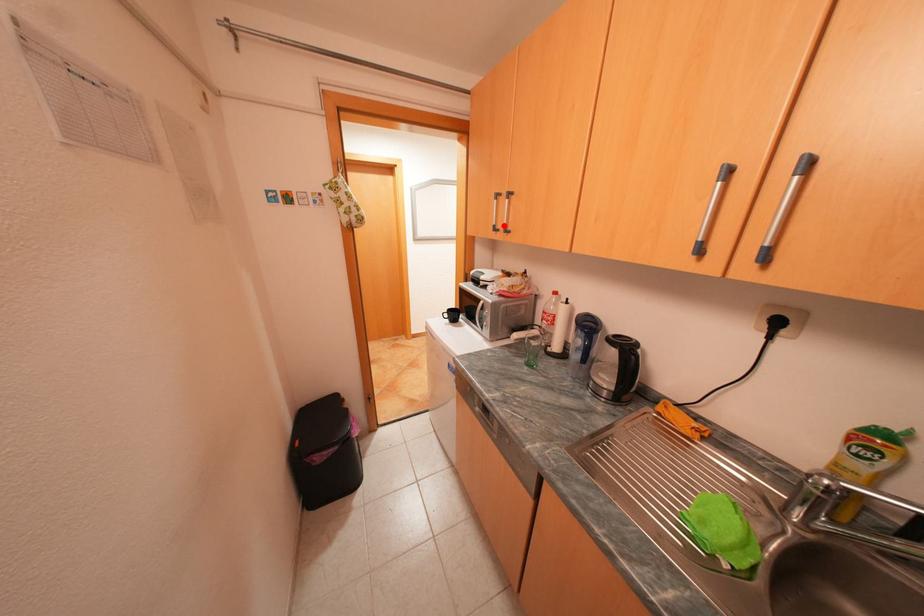
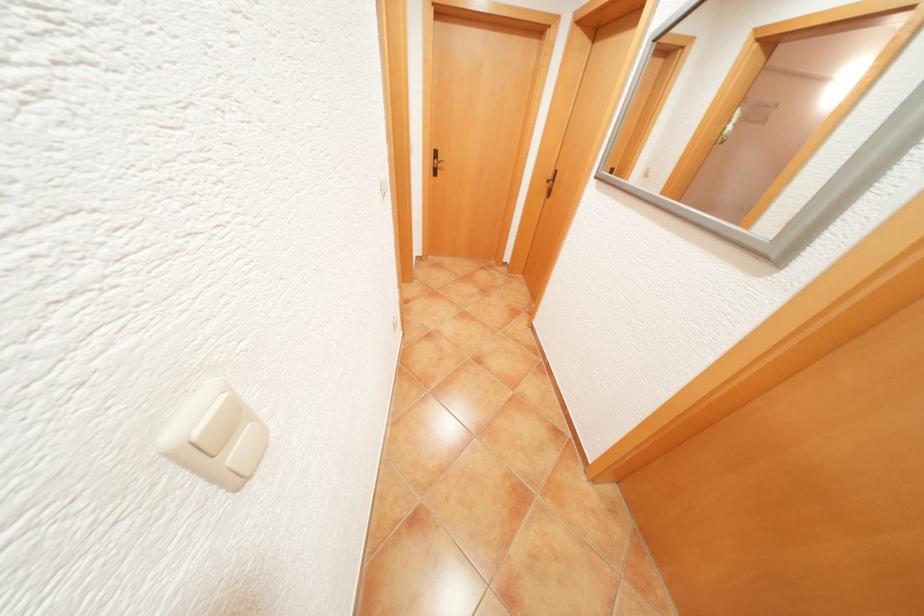
Question: I am providing you with two images of the same scene from different viewpoints. A red point is marked on the first image. Is the red point's position out of view in image 2?

Choices:
 (A) Yes
 (B) No

Answer: (A)